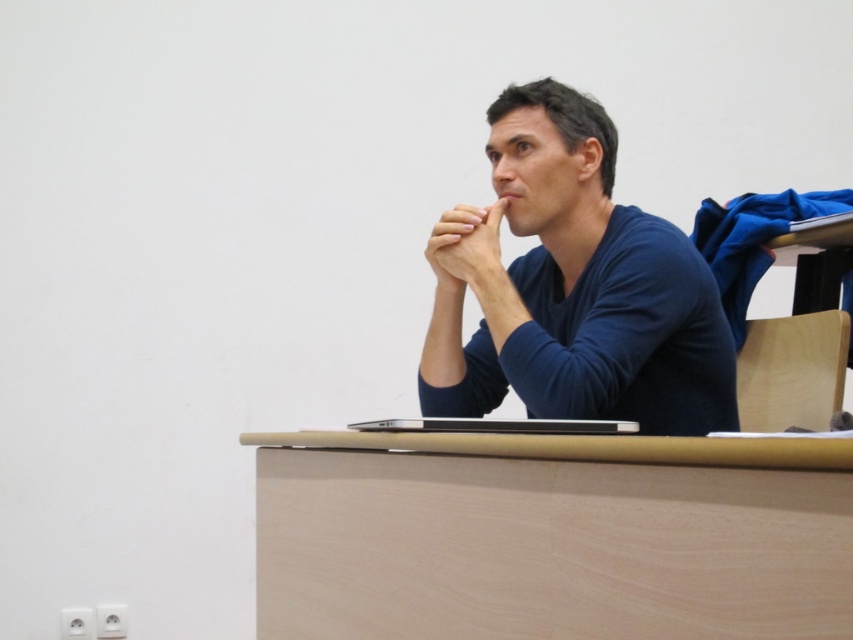
Is blue matte sweater at center positioned before smooth skin hand at center?

Yes, it is in front of smooth skin hand at center.

Who is taller, blue matte sweater at center or smooth skin hand at center?

blue matte sweater at center

What do you see at coordinates (573, 288) in the screenshot? The image size is (853, 640). I see `blue matte sweater at center` at bounding box center [573, 288].

The image size is (853, 640). I want to click on blue matte sweater at center, so click(x=573, y=288).

Between sleek silver laptop at center and smooth skin hand at center, which one has less height?

sleek silver laptop at center is shorter.

Is point (453, 424) less distant than point (434, 259)?

Yes, it is in front of point (434, 259).

Find the location of a particular element. The width and height of the screenshot is (853, 640). sleek silver laptop at center is located at coordinates point(498,426).

Does point (596, 502) come behind point (439, 257)?

No, (596, 502) is closer to viewer.

You are a GUI agent. You are given a task and a screenshot of the screen. Output one action in this format:
    pyautogui.click(x=<x>, y=<y>)
    Task: Click on the light brown wood table at center
    
    Given the screenshot: What is the action you would take?
    pyautogui.click(x=550, y=536)

What are the coordinates of `light brown wood table at center` in the screenshot? It's located at (550, 536).